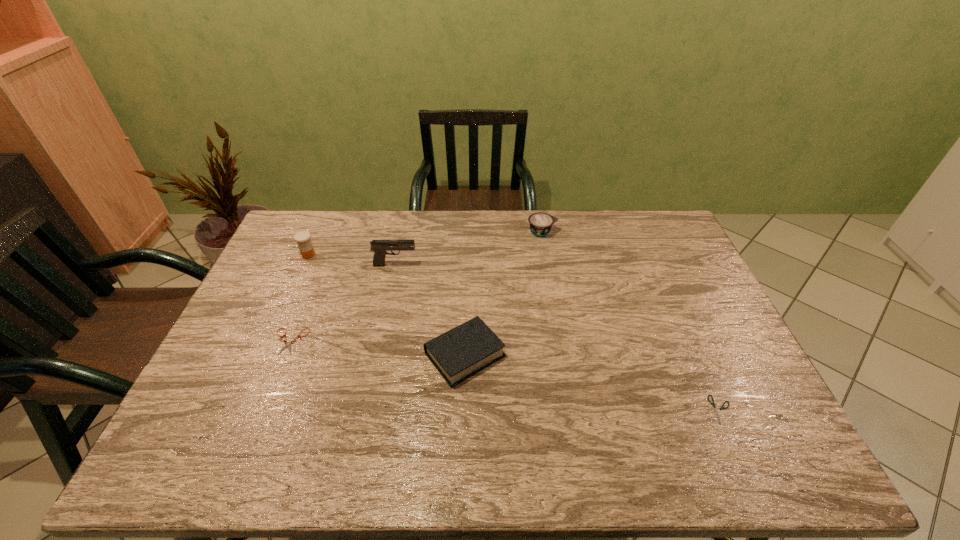
Find the location of `the shorter shears`. the shorter shears is located at coordinates (716, 413).

Identify the location of vacant space located 0.080m aim along the barrel of the third object from left to right. (441, 265).

This screenshot has width=960, height=540. What are the coordinates of `free region located 0.240m on the label of the medicine` in the screenshot? It's located at (385, 255).

Find the location of a particular element. The width and height of the screenshot is (960, 540). vacant space located on the back of the farthest object is located at coordinates (539, 211).

The image size is (960, 540). I want to click on blank space located 0.330m on the back of the Bible, so click(x=468, y=253).

You are a GUI agent. You are given a task and a screenshot of the screen. Output one action in this format:
    pyautogui.click(x=<x>, y=<y>)
    Task: Click on the free space located 0.070m on the right of the left shears
    The width and height of the screenshot is (960, 540).
    Given the screenshot: What is the action you would take?
    pyautogui.click(x=331, y=341)

Find the location of a particular element. free location located 0.370m on the back of the right shears is located at coordinates (667, 293).

This screenshot has width=960, height=540. Identify the location of medicine present at the far edge. (302, 238).

This screenshot has width=960, height=540. What are the coordinates of `yogurt at the far edge` in the screenshot? It's located at (540, 223).

Image resolution: width=960 pixels, height=540 pixels. Identify the location of medicine that is at the left edge. (302, 238).